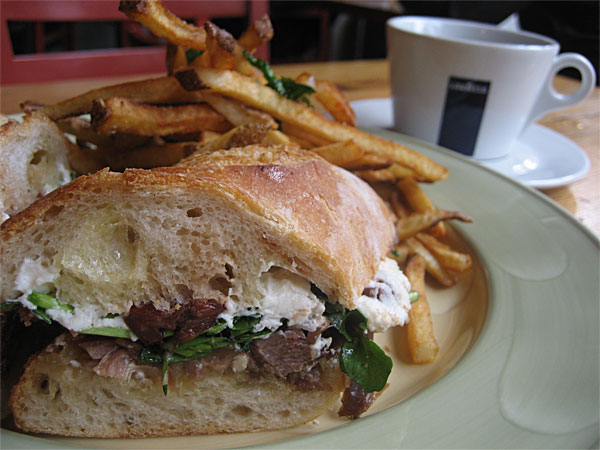
Where is `handle of cup`? This screenshot has height=450, width=600. handle of cup is located at coordinates (576, 65).